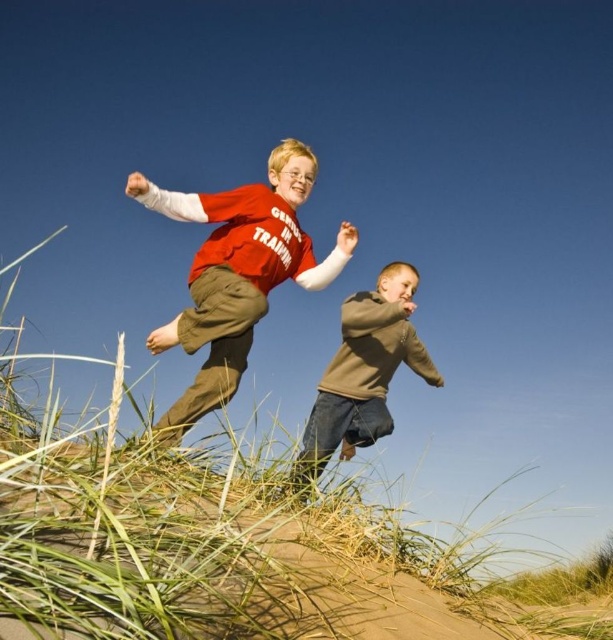
In the scene shown: You are a photographer standing at the base of the dune. You want to take a photo of the brown cotton sweater at center and the green grass at lower left. Which object should you pan your camera to the left to capture?

You should pan your camera to the left to capture the green grass at lower left because it is positioned to the left of the brown cotton sweater at center.

You are a photographer trying to capture the children playing on the dune. You notice the green grass at lower left and the brown cotton sweater at center. Which object should you focus on if you want to capture the larger one in your shot?

The green grass at lower left is bigger than the brown cotton sweater at center, so you should focus on the green grass at lower left to capture the larger one in your shot.

You are a photographer trying to capture the children running up the dune. You notice the green grass at lower left and the brown cotton sweater at center. Which object is taller in the image?

The green grass at lower left is taller than the brown cotton sweater at center.